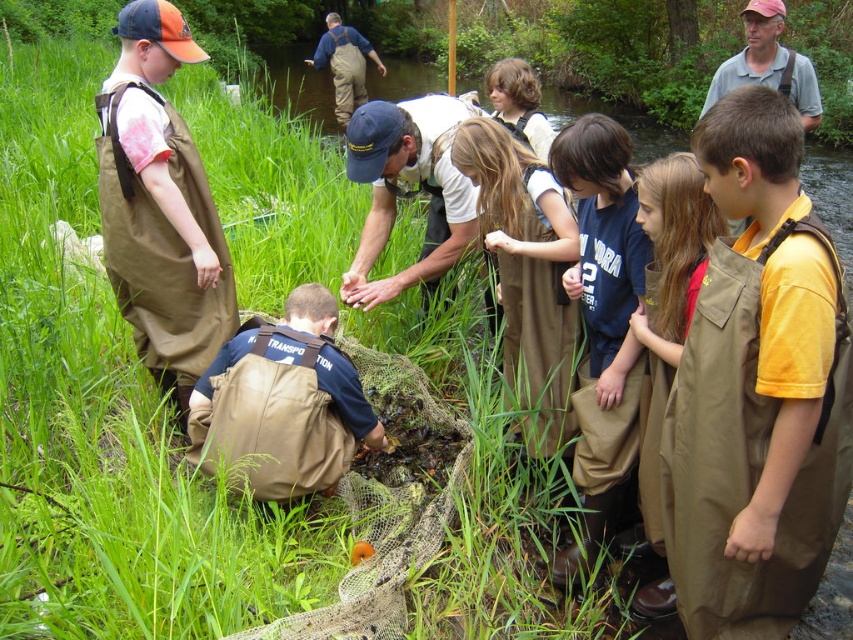
Does brown leather vest at center have a smaller size compared to brown waterproof apron at center?

Correct, brown leather vest at center occupies less space than brown waterproof apron at center.

Which is behind, point (329, 376) or point (492, 154)?

The point (492, 154) is behind.

At what (x,y) coordinates should I click in order to perform the action: click on brown leather vest at center. Please return your answer as a coordinate pair (x, y). The image size is (853, 640). Looking at the image, I should click on tap(283, 403).

Is point (561, 285) positioned behind point (654, 493)?

Yes, point (561, 285) is behind point (654, 493).

The image size is (853, 640). Describe the element at coordinates (602, 326) in the screenshot. I see `dark blue t-shirt at center` at that location.

Measure the distance between dark blue t-shirt at center and camera.

dark blue t-shirt at center is 7.75 feet away from camera.

Identify the location of dark blue t-shirt at center. (602, 326).

Between khakimaterial at left and brown waterproof apron at center, which one is positioned lower?

Positioned lower is brown waterproof apron at center.

Which is in front, point (199, 61) or point (555, 224)?

Positioned in front is point (555, 224).

Identify the location of khakimaterial at left. Image resolution: width=853 pixels, height=640 pixels. (160, 205).